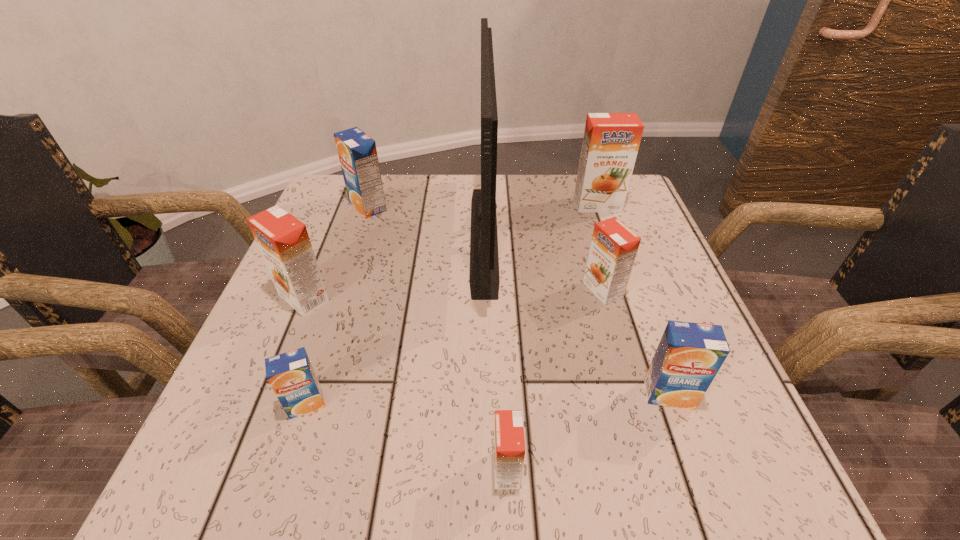
Locate an element on the screen. The height and width of the screenshot is (540, 960). orange juice that is the fifth closest one to the monitor is located at coordinates (689, 355).

Point out which orange juice is positioned as the third nearest to the farthest blue orange_juice. Please provide its 2D coordinates. Your answer should be formatted as a tuple, i.e. [(x, y)], where the tuple contains the x and y coordinates of a point satisfying the conditions above.

[(291, 375)]

Locate an element on the screen. orange orange juice that is the closest to the second orange orange juice from left to right is located at coordinates (613, 249).

Identify which orange orange juice is the third closest to the second biggest orange orange juice. Please provide its 2D coordinates. Your answer should be formatted as a tuple, i.e. [(x, y)], where the tuple contains the x and y coordinates of a point satisfying the conditions above.

[(611, 141)]

Locate which blue orange_juice ranks second in proximity to the leftmost orange orange juice. Please provide its 2D coordinates. Your answer should be formatted as a tuple, i.e. [(x, y)], where the tuple contains the x and y coordinates of a point satisfying the conditions above.

[(357, 152)]

Select which blue orange_juice is the second closest to the third biggest orange orange juice. Please provide its 2D coordinates. Your answer should be formatted as a tuple, i.e. [(x, y)], where the tuple contains the x and y coordinates of a point satisfying the conditions above.

[(357, 152)]

Locate an element on the screen. vacant area that satisfies the following two spatial constraints: 1. on the front-facing side of the second smallest blue orange_juice; 2. on the left side of the tallest object is located at coordinates 486,394.

At what (x,y) coordinates should I click in order to perform the action: click on vacant space that satisfies the following two spatial constraints: 1. on the front side of the biggest blue orange_juice; 2. on the right side of the nearest orange juice. Please return your answer as a coordinate pair (x, y). This screenshot has height=540, width=960. Looking at the image, I should click on (281, 469).

You are a GUI agent. You are given a task and a screenshot of the screen. Output one action in this format:
    pyautogui.click(x=<x>, y=<y>)
    Task: Click on the vacant position in the image that satisfies the following two spatial constraints: 1. on the front side of the smallest blue orange_juice; 2. on the right side of the nearest orange orange juice
    The width and height of the screenshot is (960, 540).
    Given the screenshot: What is the action you would take?
    pyautogui.click(x=285, y=469)

Identify the location of free region that satisfies the following two spatial constraints: 1. on the back side of the nearest orange juice; 2. on the left side of the third biggest orange orange juice. This screenshot has height=540, width=960. (498, 289).